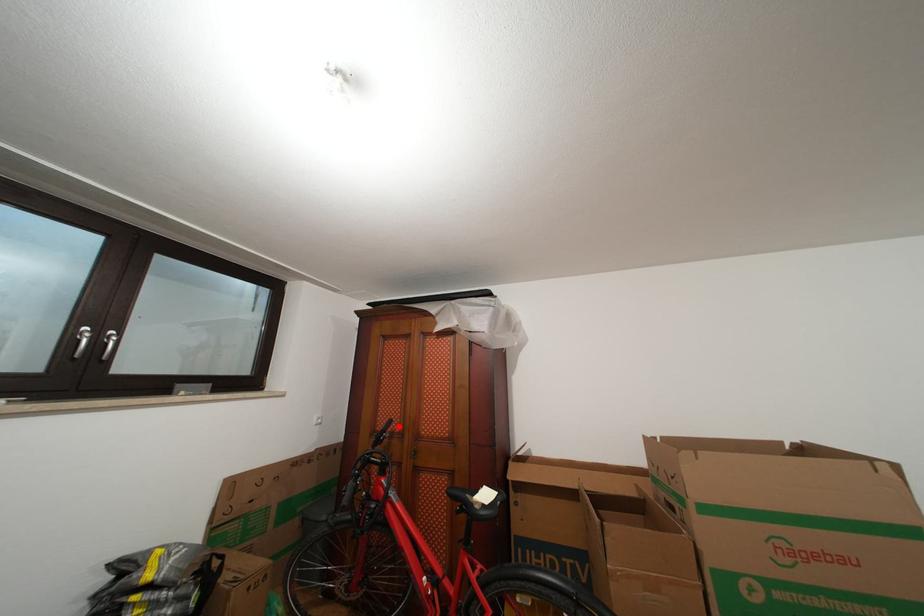
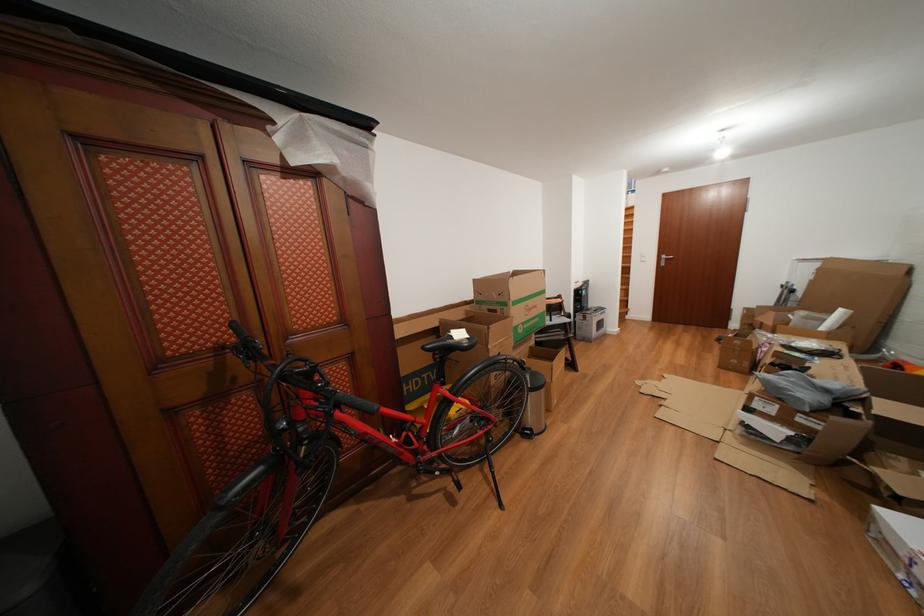
Locate, in the second image, the point that corresponds to the highlighted location in the first image.

(241, 330)